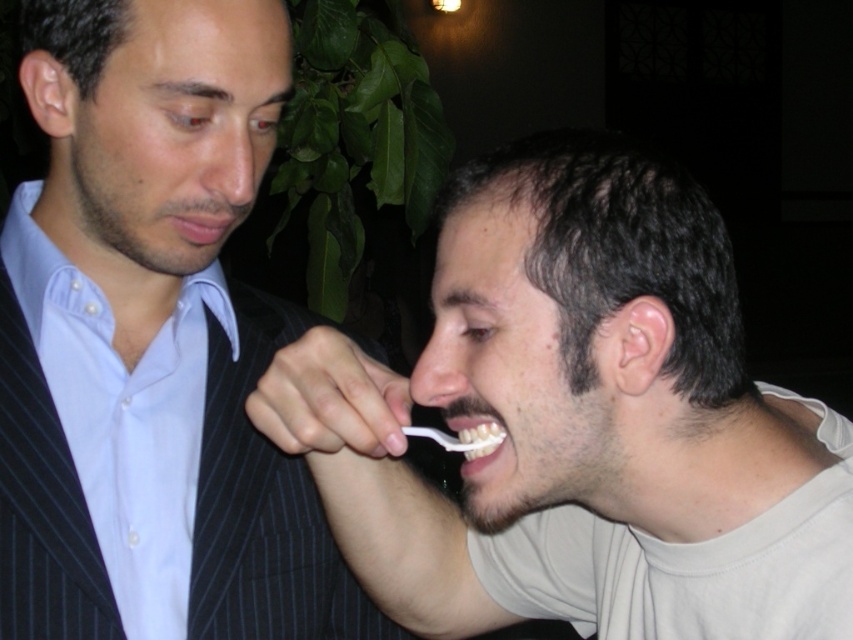
Looking at this image, between white matte toothbrush at upper left and white plastic toothbrush at lower center, which one has more height?

white matte toothbrush at upper left is taller.

Does white matte toothbrush at upper left have a smaller size compared to white plastic toothbrush at lower center?

Incorrect, white matte toothbrush at upper left is not smaller in size than white plastic toothbrush at lower center.

This screenshot has width=853, height=640. In order to click on white matte toothbrush at upper left in this screenshot , I will do `click(154, 150)`.

You are a GUI agent. You are given a task and a screenshot of the screen. Output one action in this format:
    pyautogui.click(x=<x>, y=<y>)
    Task: Click on the white matte toothbrush at upper left
    Image resolution: width=853 pixels, height=640 pixels.
    Given the screenshot: What is the action you would take?
    pyautogui.click(x=154, y=150)

Does white matte toothbrush at upper left have a lesser width compared to white glossy toothbrush at lower center?

In fact, white matte toothbrush at upper left might be wider than white glossy toothbrush at lower center.

What are the coordinates of `white matte toothbrush at upper left` in the screenshot? It's located at (154, 150).

Between point (489, 451) and point (402, 428), which one is positioned in front?

Point (489, 451)

What do you see at coordinates (480, 436) in the screenshot? I see `white glossy toothbrush at lower center` at bounding box center [480, 436].

I want to click on white glossy toothbrush at lower center, so click(480, 436).